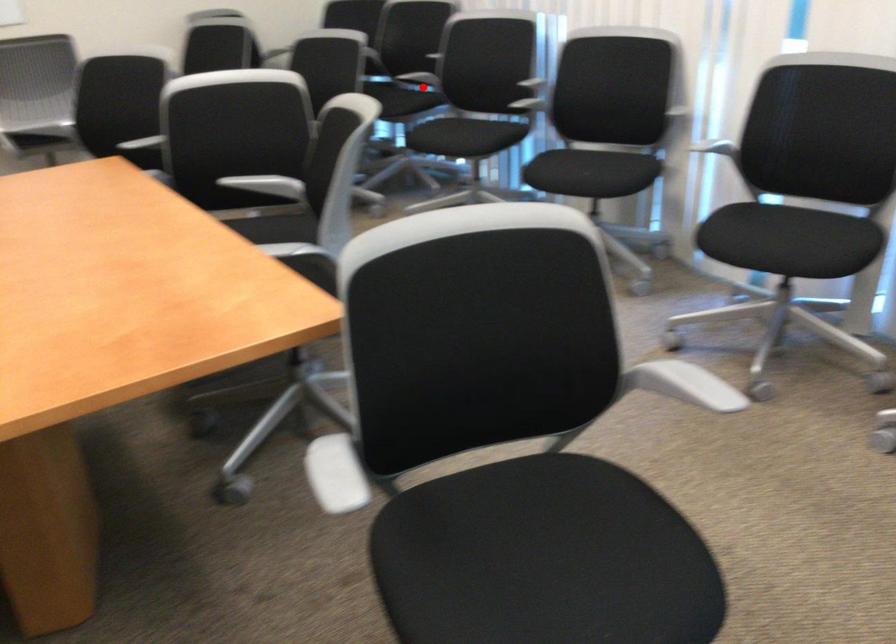
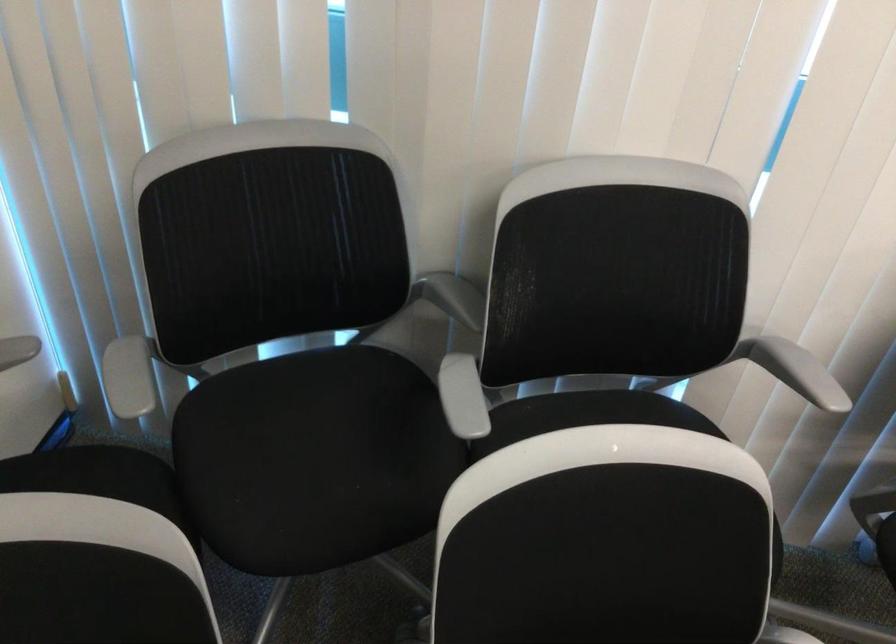
Question: I am providing you with two images of the same scene from different viewpoints. Given a red point in image1, look at the same physical point in image2. Is it:

Choices:
 (A) Closer to the viewpoint
 (B) Farther from the viewpoint

Answer: (A)